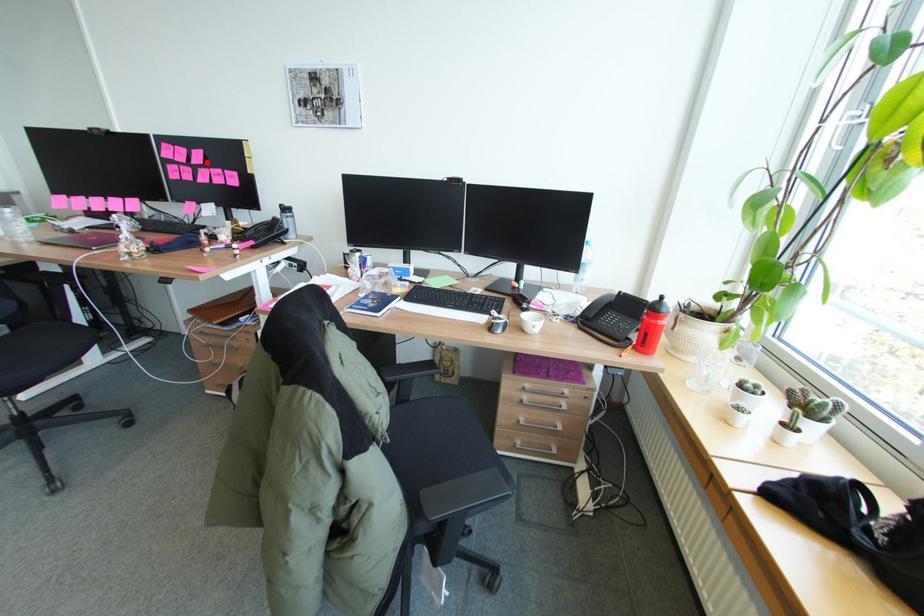
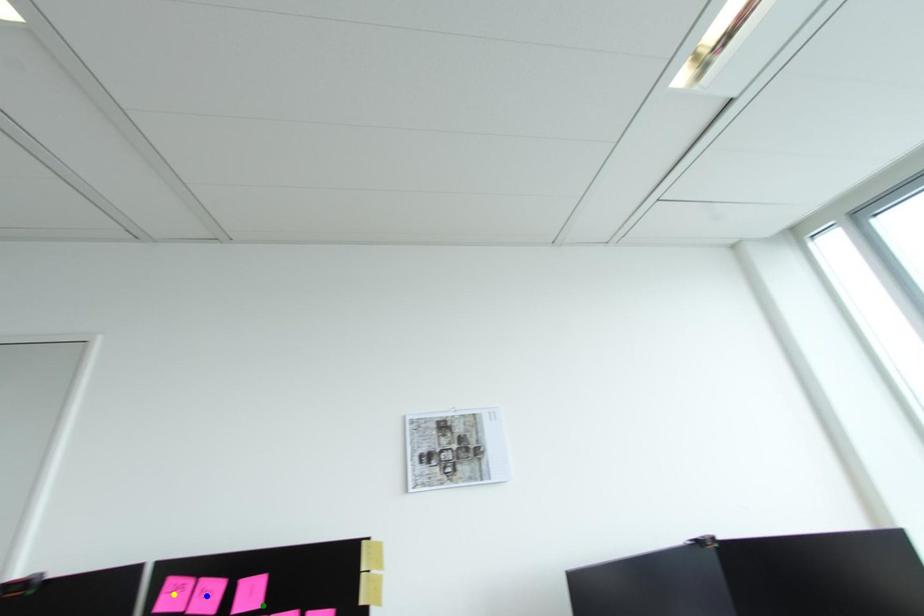
Question: I am providing you with two images of the same scene from different viewpoints. A red point is marked on the first image. You are given multiple points on the second image. Which spot in image 2 lines up with the point in image 1?

Choices:
 (A) blue point
 (B) green point
 (C) yellow point

Answer: (B)